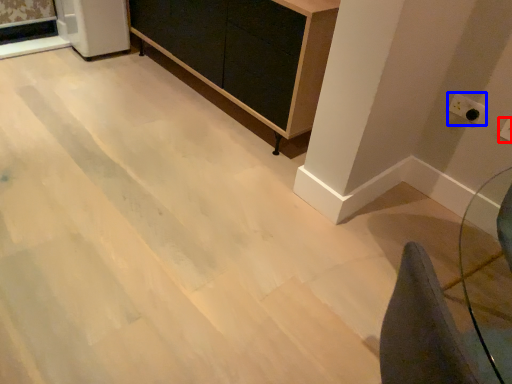
Question: Which point is further to the camera, electric outlet (highlighted by a red box) or electric outlet (highlighted by a blue box)?

Choices:
 (A) electric outlet
 (B) electric outlet

Answer: (B)